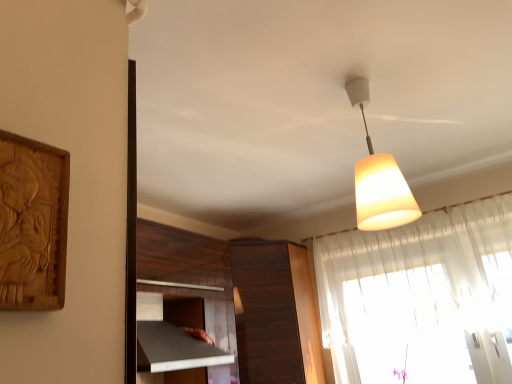
Question: From a real-world perspective, is dark wood cabinet at center positioned under translucent fabric curtain at upper right based on gravity?

Choices:
 (A) yes
 (B) no

Answer: (A)

Question: Can you confirm if dark wood cabinet at center is smaller than translucent fabric curtain at upper right?

Choices:
 (A) no
 (B) yes

Answer: (A)

Question: Is dark wood cabinet at center thinner than translucent fabric curtain at upper right?

Choices:
 (A) yes
 (B) no

Answer: (B)

Question: Is dark wood cabinet at center to the right of translucent fabric curtain at upper right from the viewer's perspective?

Choices:
 (A) yes
 (B) no

Answer: (B)

Question: Is dark wood cabinet at center positioned behind translucent fabric curtain at upper right?

Choices:
 (A) no
 (B) yes

Answer: (B)

Question: Would you say translucent fabric curtain at upper right is to the left or to the right of white matte lampshade at upper center in the picture?

Choices:
 (A) left
 (B) right

Answer: (B)

Question: From a real-world perspective, is translucent fabric curtain at upper right positioned above or below white matte lampshade at upper center?

Choices:
 (A) above
 (B) below

Answer: (B)

Question: Which is correct: translucent fabric curtain at upper right is inside white matte lampshade at upper center, or outside of it?

Choices:
 (A) outside
 (B) inside

Answer: (A)

Question: In terms of size, does translucent fabric curtain at upper right appear bigger or smaller than white matte lampshade at upper center?

Choices:
 (A) small
 (B) big

Answer: (B)

Question: Is dark wood cabinet at center situated inside translucent fabric curtain at upper right or outside?

Choices:
 (A) inside
 (B) outside

Answer: (B)

Question: Considering the positions of dark wood cabinet at center and translucent fabric curtain at upper right in the image, is dark wood cabinet at center taller or shorter than translucent fabric curtain at upper right?

Choices:
 (A) tall
 (B) short

Answer: (A)

Question: Relative to translucent fabric curtain at upper right, is dark wood cabinet at center in front or behind?

Choices:
 (A) behind
 (B) front

Answer: (A)

Question: From a real-world perspective, is dark wood cabinet at center above or below translucent fabric curtain at upper right?

Choices:
 (A) above
 (B) below

Answer: (B)

Question: From the image's perspective, is white matte lampshade at upper center above or below dark wood cabinet at center?

Choices:
 (A) above
 (B) below

Answer: (A)

Question: Based on their sizes in the image, would you say white matte lampshade at upper center is bigger or smaller than dark wood cabinet at center?

Choices:
 (A) big
 (B) small

Answer: (B)